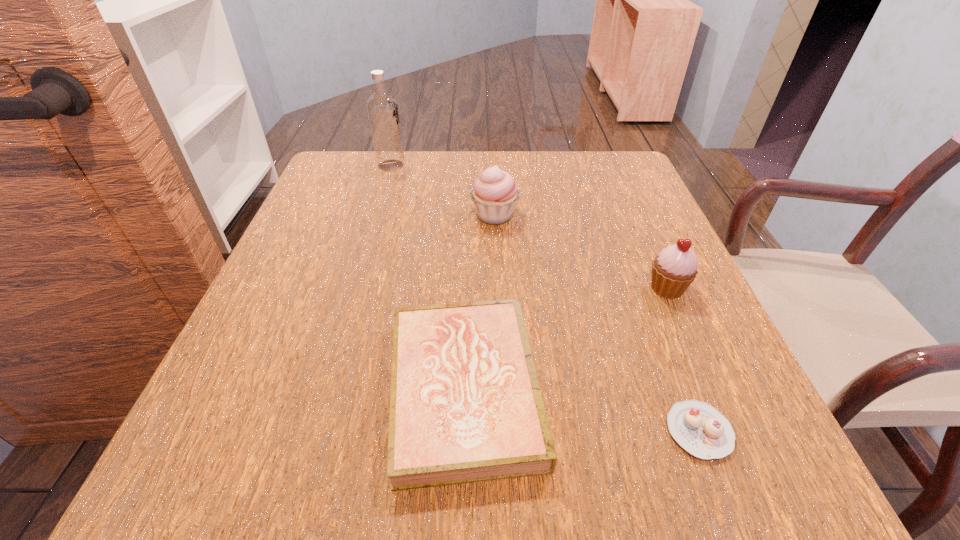
Locate an element on the screen. Image resolution: width=960 pixels, height=540 pixels. the tallest object is located at coordinates (382, 108).

Image resolution: width=960 pixels, height=540 pixels. I want to click on the farthest object, so click(382, 108).

Image resolution: width=960 pixels, height=540 pixels. I want to click on the farthest cupcake, so click(x=495, y=193).

Locate an element on the screen. The width and height of the screenshot is (960, 540). the leftmost cupcake is located at coordinates (495, 193).

Image resolution: width=960 pixels, height=540 pixels. Find the location of `the third farthest object`. the third farthest object is located at coordinates (675, 268).

The width and height of the screenshot is (960, 540). I want to click on hardback book, so click(465, 405).

What are the coordinates of `the shortest object` in the screenshot? It's located at (700, 429).

What are the coordinates of `the nearest cupcake` in the screenshot? It's located at (700, 429).

Locate an element on the screen. This screenshot has height=540, width=960. vacant space located 0.060m on the front label of the tallest object is located at coordinates (429, 165).

This screenshot has width=960, height=540. In order to click on free location located on the front of the fourth nearest object in this screenshot , I will do `click(501, 382)`.